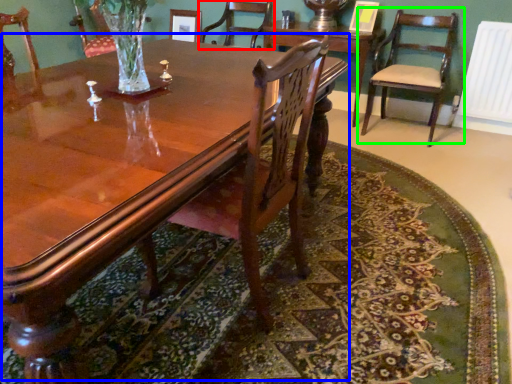
Question: Which object is positioned closest to chair (highlighted by a red box)? Select from coffee table (highlighted by a blue box) and chair (highlighted by a green box).

Choices:
 (A) coffee table
 (B) chair

Answer: (B)